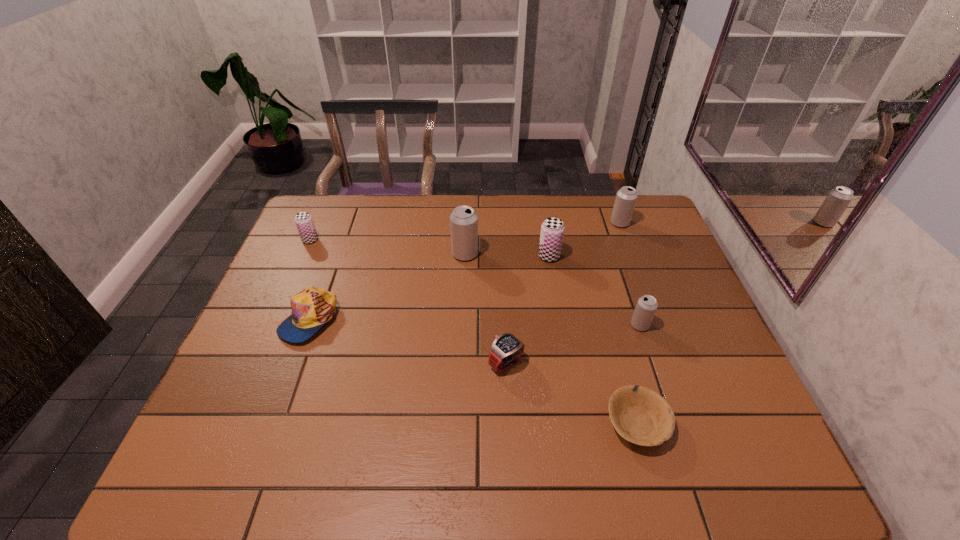
The width and height of the screenshot is (960, 540). Find the location of `cap`. cap is located at coordinates (311, 308).

Locate an element on the screen. red watch is located at coordinates (506, 349).

Image resolution: width=960 pixels, height=540 pixels. Find the location of `the fifth object from right to left`. the fifth object from right to left is located at coordinates (506, 349).

Where is `bowl`? This screenshot has width=960, height=540. bowl is located at coordinates (641, 416).

Locate an element on the screen. The width and height of the screenshot is (960, 540). the nearest object is located at coordinates (641, 416).

Find the location of a particular element. This screenshot has width=960, height=540. free spot located on the right of the tallest object is located at coordinates (604, 254).

At what (x,y) coordinates should I click in order to perform the action: click on vacant space located 0.280m on the front of the nearer purple beer can. Please return your answer as a coordinate pair (x, y). This screenshot has height=540, width=960. Looking at the image, I should click on (563, 334).

You are a GUI agent. You are given a task and a screenshot of the screen. Output one action in this format:
    pyautogui.click(x=<x>, y=<y>)
    Task: Click on the free space located on the left of the farthest white beer can
    The width and height of the screenshot is (960, 540).
    Given the screenshot: What is the action you would take?
    [x=572, y=223]

Locate an element on the screen. vacant area located on the back of the left purple beer can is located at coordinates (322, 214).

You are a GUI agent. You are given a task and a screenshot of the screen. Output one action in this format:
    pyautogui.click(x=<x>, y=<y>)
    Task: Click on the vacant space situated 0.120m on the left of the nearest white beer can
    
    Given the screenshot: What is the action you would take?
    pyautogui.click(x=587, y=325)